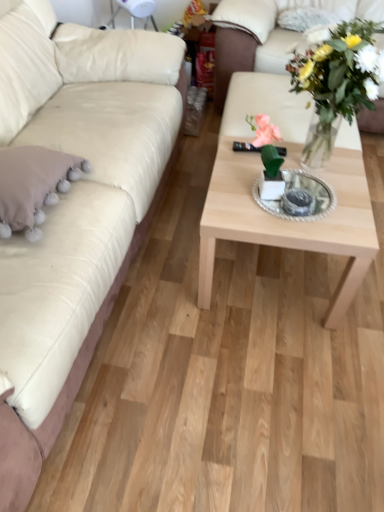
Find the location of `vacant region to the left of natural wood coffee table at center`. vacant region to the left of natural wood coffee table at center is located at coordinates (163, 270).